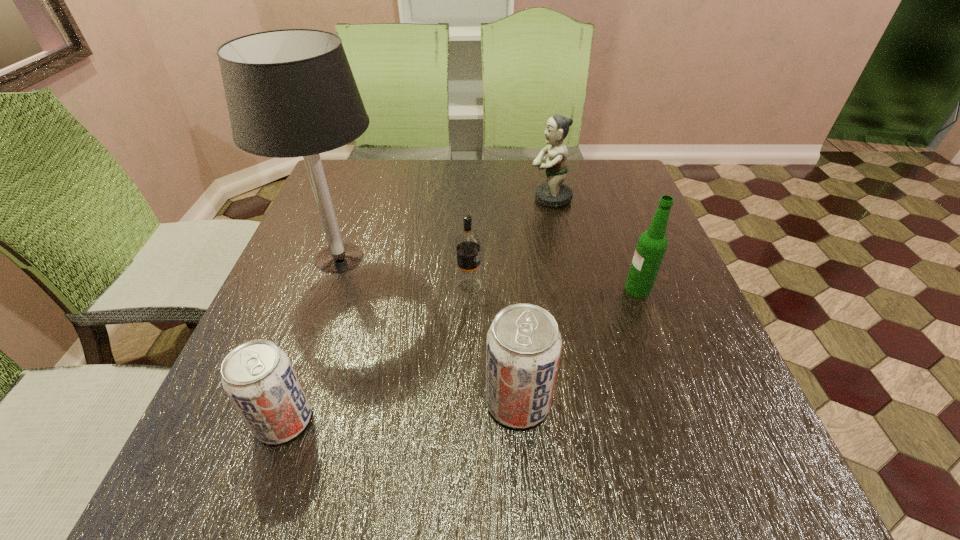
Image resolution: width=960 pixels, height=540 pixels. What are the coordinates of `vacant region between the tallest object and the vodka` in the screenshot? It's located at (404, 272).

You are a GUI agent. You are given a task and a screenshot of the screen. Output one action in this format:
    pyautogui.click(x=<x>, y=<y>)
    Task: Click on the vacant area that lies between the fourth object from right to left and the beer bottle
    
    Given the screenshot: What is the action you would take?
    pyautogui.click(x=554, y=287)

At what (x,y) coordinates should I click in order to perform the action: click on free spot between the farthest object and the vodka. Please return your answer as a coordinate pair (x, y). The height and width of the screenshot is (540, 960). Looking at the image, I should click on (510, 242).

Locate an element on the screen. The height and width of the screenshot is (540, 960). vacant area that lies between the tallest object and the vodka is located at coordinates (404, 272).

Where is `vacant area that lies between the beer bottle and the second object from right to left`? This screenshot has height=540, width=960. vacant area that lies between the beer bottle and the second object from right to left is located at coordinates (x=594, y=244).

At what (x,y) coordinates should I click in order to perform the action: click on vacant space in between the shorter soda can and the table lamp. Please return your answer as a coordinate pair (x, y). Looking at the image, I should click on (312, 339).

The width and height of the screenshot is (960, 540). What are the coordinates of `vacant area that lies between the shorter soda can and the tallest object` in the screenshot? It's located at (312, 339).

Locate an element on the screen. Image resolution: width=960 pixels, height=540 pixels. free space that is in between the table lamp and the rightmost object is located at coordinates (489, 273).

You are a GUI agent. You are given a task and a screenshot of the screen. Output one action in this format:
    pyautogui.click(x=<x>, y=<y>)
    Task: Click on the empty space between the table lamp and the second object from right to left
    This screenshot has height=540, width=960.
    Given the screenshot: What is the action you would take?
    pyautogui.click(x=444, y=228)

Image resolution: width=960 pixels, height=540 pixels. I want to click on the fourth closest object relative to the third object from left to right, so point(652,244).